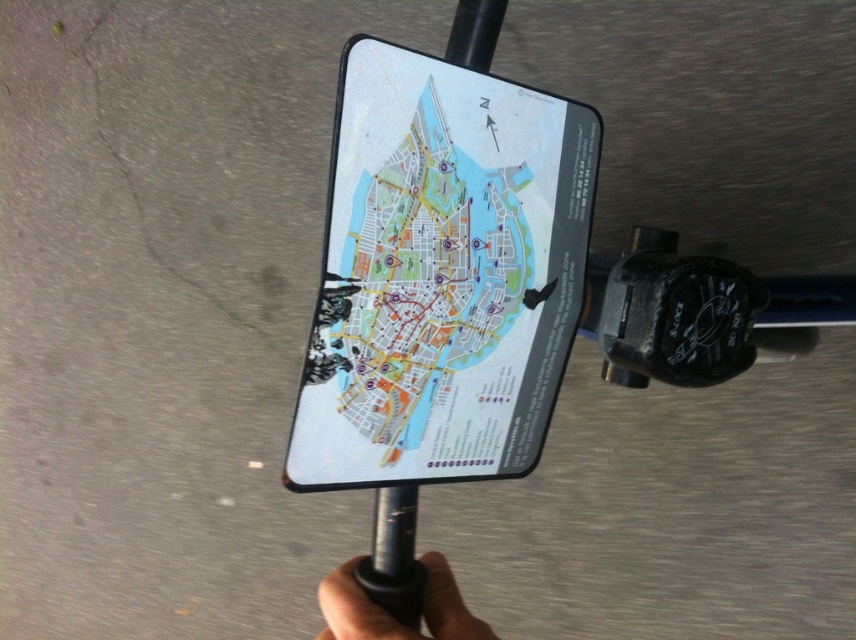
You are a cyclist holding this bicycle. You want to check your phone to see the map but need to ensure it fits within your grip area. Can the black matte phone at center fit horizontally within the black matte grip at lower center based on their widths?

The black matte phone at center has a lesser width compared to the black matte grip at lower center, so it can fit horizontally within the grip area.

You are a delivery rider who needs to check both the white matte map at center and the black matte phone at center on your handlebar. Can you reach both items comfortably without moving your hands from their current position? Assume your hand can cover a 6 inch area.

The white matte map at center and the black matte phone at center are 6.59 inches apart. Since your hand can only cover 6 inches, you cannot reach both items comfortably without moving your hands from their current position.

You are a cyclist using the map on your handlebar to navigate. The map has a point marked at coordinates [441,275]. What does this point indicate?

The point marked at coordinates [441,275] on the white matte map at center indicates the current location or a significant landmark on the map.